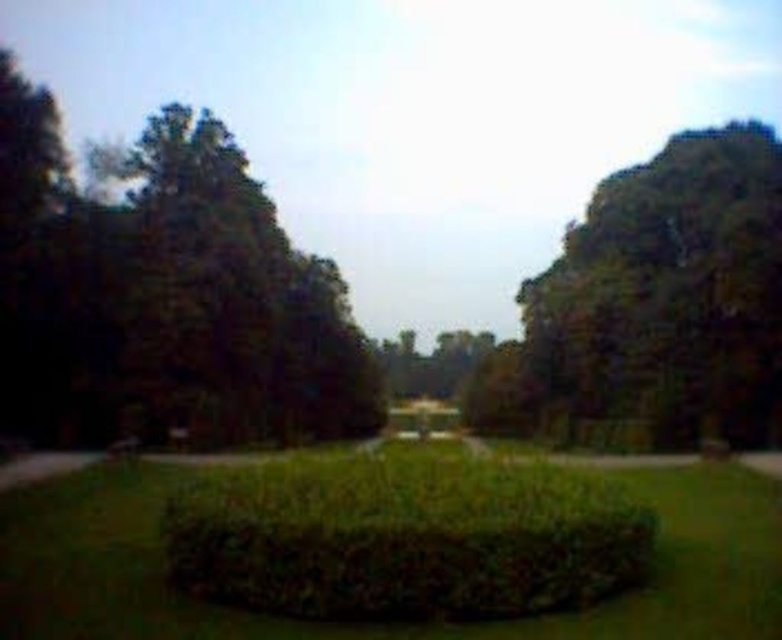
Question: Estimate the real-world distances between objects in this image. Which object is closer to the green leafy bush at center?

Choices:
 (A) green leafy tree at right
 (B) green leafy tree at left

Answer: (A)

Question: Among these points, which one is farthest from the camera?

Choices:
 (A) (199, 257)
 (B) (698, 184)
 (C) (748, 531)

Answer: (B)

Question: Does green leafy tree at left have a smaller size compared to green leafy tree at right?

Choices:
 (A) yes
 (B) no

Answer: (B)

Question: Is green leafy tree at left to the right of green leafy bush at center from the viewer's perspective?

Choices:
 (A) no
 (B) yes

Answer: (A)

Question: Does green leafy tree at left have a smaller size compared to green leafy tree at right?

Choices:
 (A) no
 (B) yes

Answer: (A)

Question: Which of the following is the closest to the observer?

Choices:
 (A) (271, 364)
 (B) (708, 570)
 (C) (720, 352)

Answer: (B)